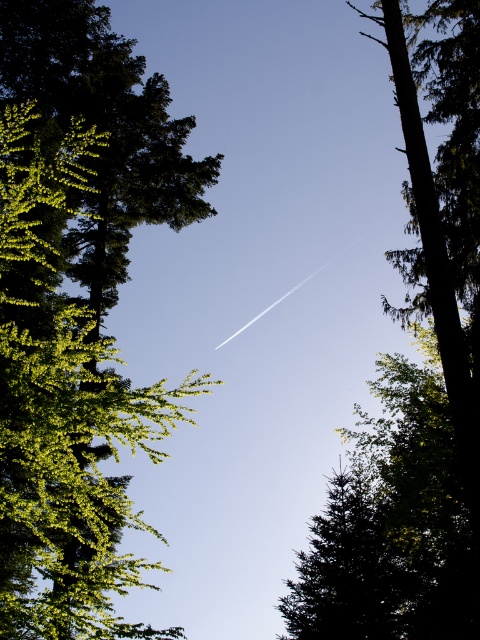
Question: Which of the following is the farthest from the observer?

Choices:
 (A) green leafy tree at upper left
 (B) green textured tree at lower center

Answer: (B)

Question: Which of the following is the farthest from the observer?

Choices:
 (A) green leafy tree at upper left
 (B) green textured tree at lower center

Answer: (B)

Question: Is green leafy tree at upper left below green textured tree at lower center?

Choices:
 (A) no
 (B) yes

Answer: (A)

Question: Is green leafy tree at upper left above green textured tree at lower center?

Choices:
 (A) yes
 (B) no

Answer: (A)

Question: Does green leafy tree at upper left have a larger size compared to green textured tree at lower center?

Choices:
 (A) yes
 (B) no

Answer: (A)